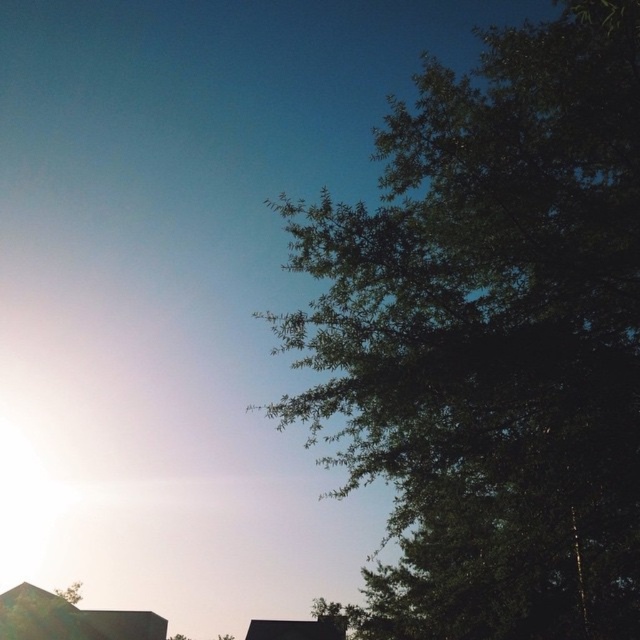
Question: Is green leafy tree at right to the left of green leafy tree at lower left from the viewer's perspective?

Choices:
 (A) no
 (B) yes

Answer: (A)

Question: Which object appears farthest from the camera in this image?

Choices:
 (A) green leafy tree at lower left
 (B) green leafy tree at right

Answer: (A)

Question: Which point is closer to the camera?

Choices:
 (A) (76, 586)
 (B) (436, 390)

Answer: (B)

Question: Does green leafy tree at right appear on the left side of green leafy tree at lower left?

Choices:
 (A) yes
 (B) no

Answer: (B)

Question: Does green leafy tree at right have a greater width compared to green leafy tree at lower left?

Choices:
 (A) no
 (B) yes

Answer: (A)